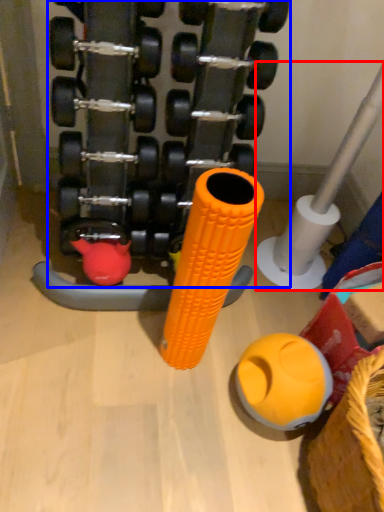
Question: Which point is closer to the camera, pipe (highlighted by a red box) or dumbbell (highlighted by a blue box)?

Choices:
 (A) pipe
 (B) dumbbell

Answer: (B)